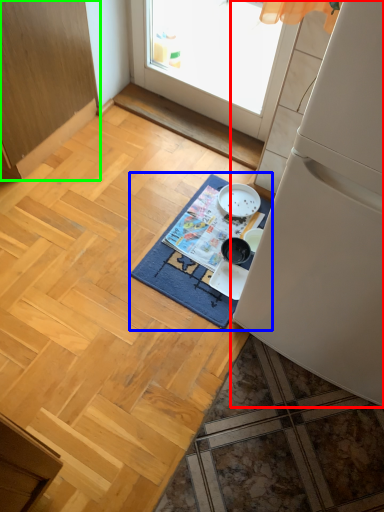
Question: Estimate the real-world distances between objects in this image. Which object is closer to refrigerator (highlighted by a red box), mat (highlighted by a blue box) or cabinetry (highlighted by a green box)?

Choices:
 (A) mat
 (B) cabinetry

Answer: (A)